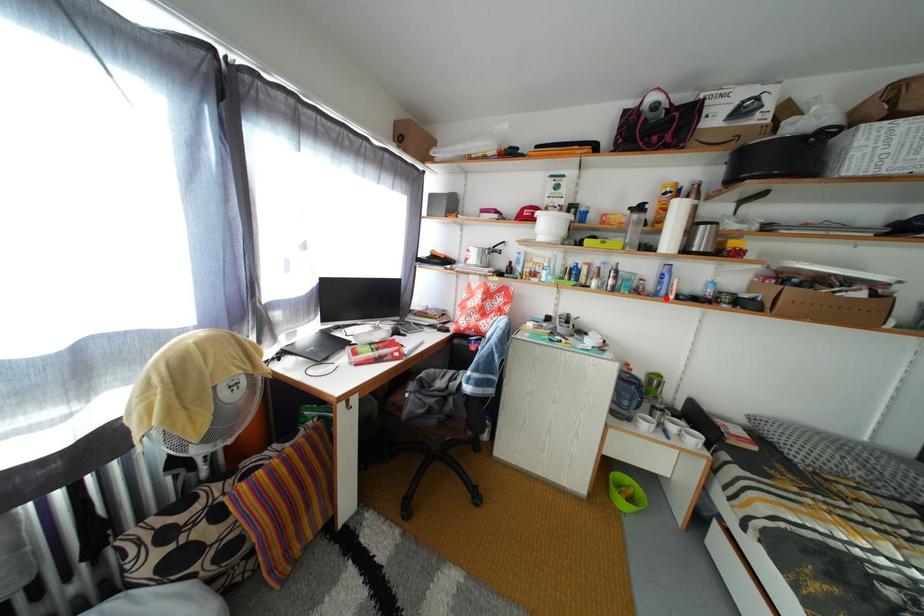
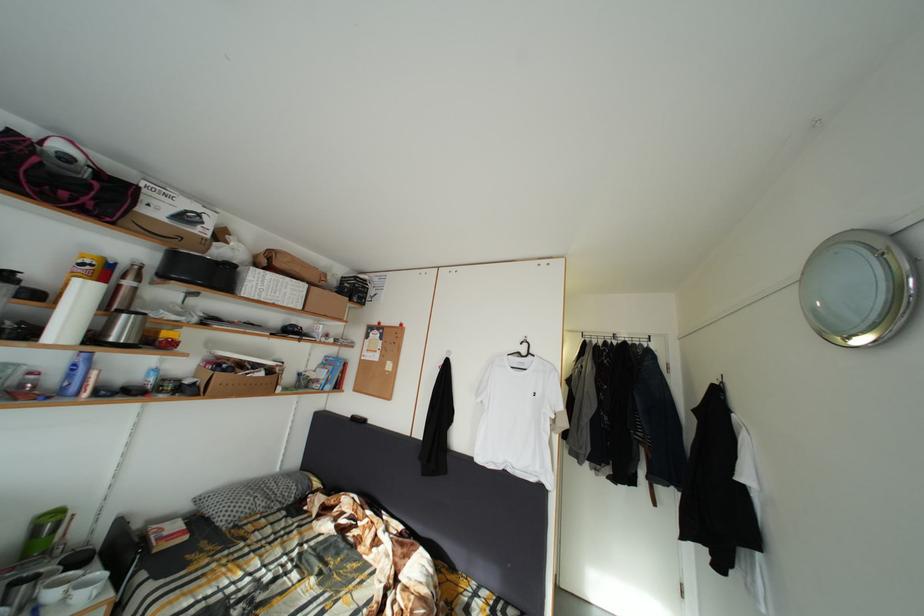
Where in the second image is the point corresponding to the highlighted location from the first image?

(73, 395)